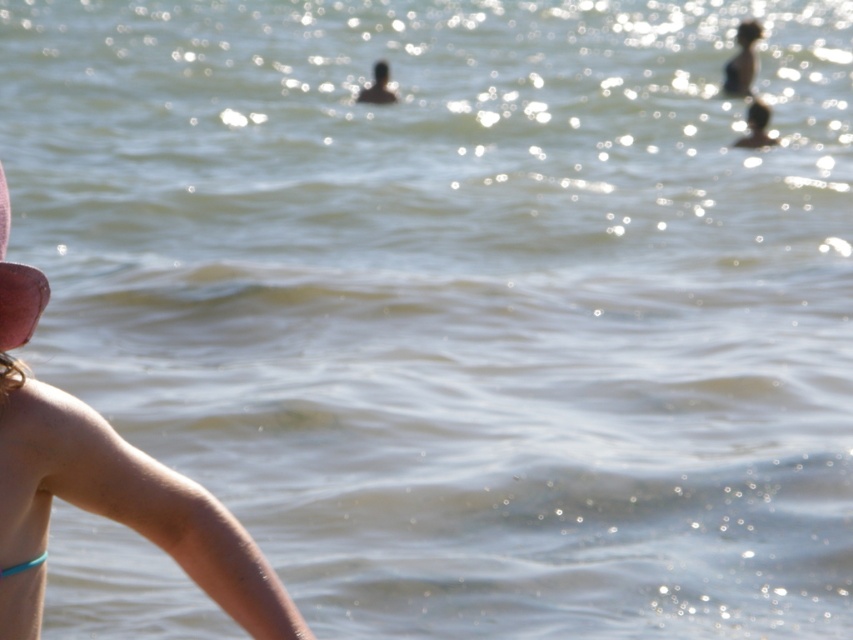
Is tan skin arm at lower left thinner than pink fabric hat at left?

Incorrect, tan skin arm at lower left's width is not less than pink fabric hat at left's.

Between tan skin arm at lower left and pink fabric hat at left, which one is positioned lower?

tan skin arm at lower left is lower down.

Where is `tan skin arm at lower left`? The image size is (853, 640). tan skin arm at lower left is located at coordinates (105, 492).